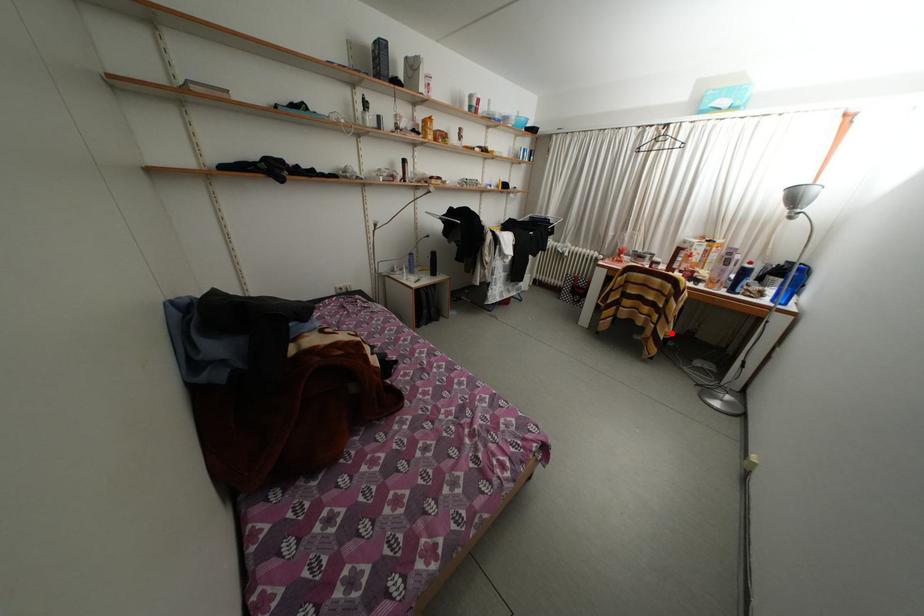
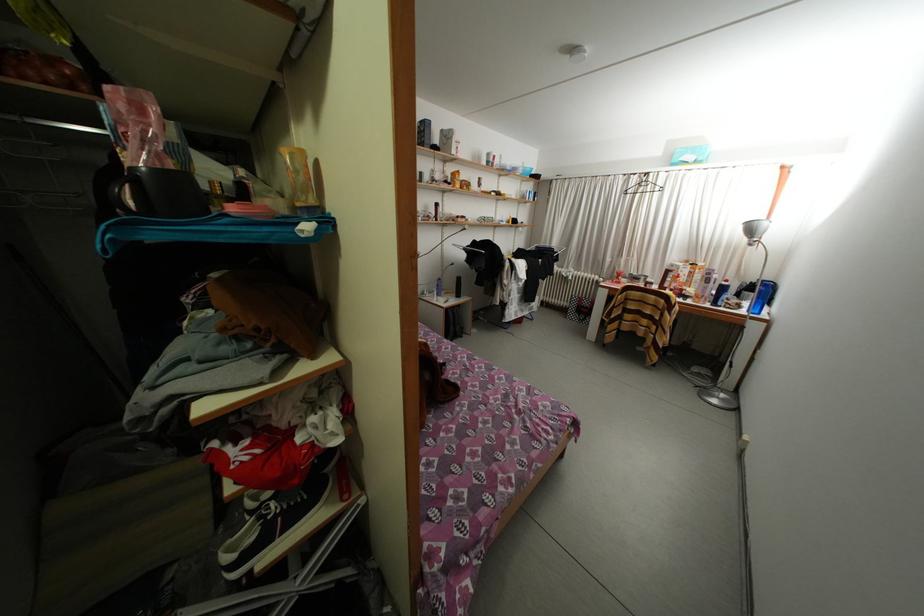
Find the pixel in the second image that matches the highlighted location in the first image.

(670, 342)